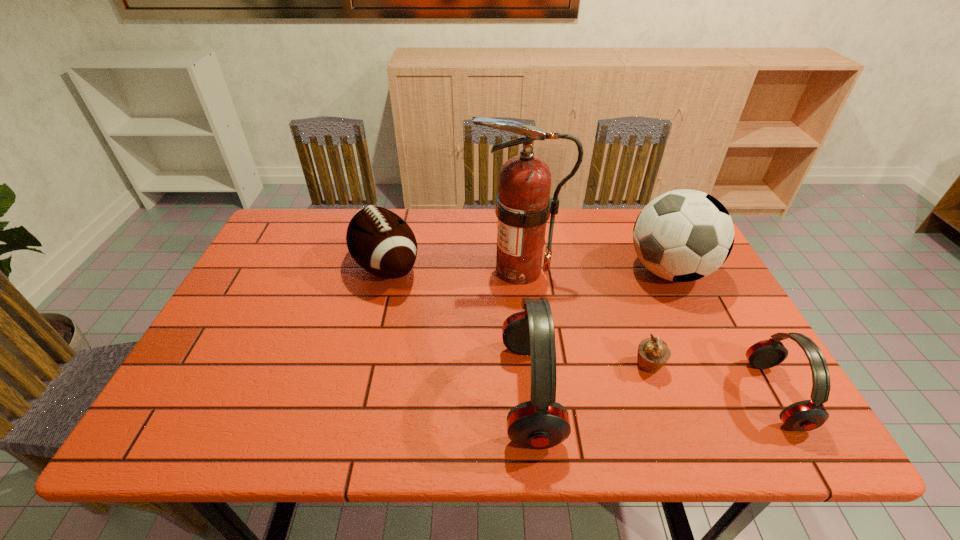
In order to click on vacant region between the right earphone and the soccer ball in this screenshot , I will do `click(722, 333)`.

Where is `the fourth closest object to the shortest object`? The width and height of the screenshot is (960, 540). the fourth closest object to the shortest object is located at coordinates (x=523, y=205).

Where is `object that stands as the third closest to the taller earphone`? The image size is (960, 540). object that stands as the third closest to the taller earphone is located at coordinates (381, 242).

The width and height of the screenshot is (960, 540). What are the coordinates of `vacant position in the image that satisfies the following two spatial constraints: 1. at the nozzle of the muffin; 2. on the left side of the fire extinguisher` in the screenshot? It's located at (529, 366).

At what (x,y) coordinates should I click in order to perform the action: click on vacant position in the image that satisfies the following two spatial constraints: 1. at the nozzle of the muffin; 2. on the right side of the tallest object. Please return your answer as a coordinate pair (x, y). This screenshot has height=540, width=960. Looking at the image, I should click on (529, 366).